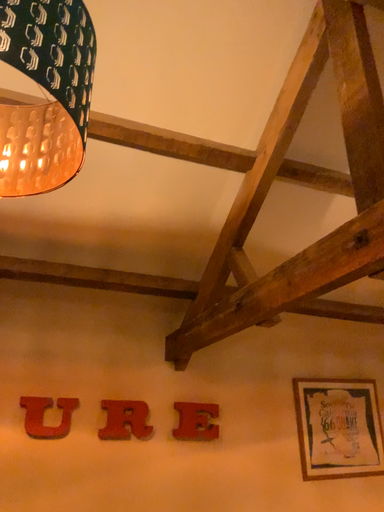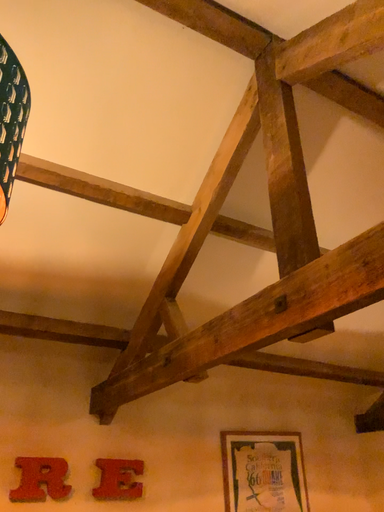
Question: How did the camera likely rotate when shooting the video?

Choices:
 (A) rotated left
 (B) rotated right

Answer: (B)